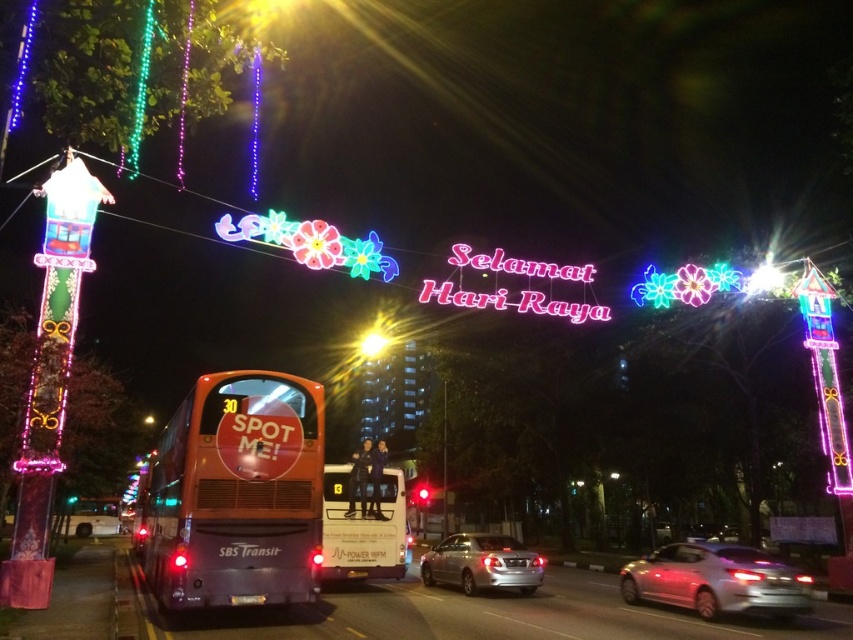
Looking at this image, you are a photographer wanting to capture both the matte orange bus at center and the silver metallic sedan at center in a single frame. Given their heights, which vehicle should you position closer to the camera to ensure both are fully visible without cropping?

Since the matte orange bus at center is much taller than the silver metallic sedan at center, you should position the matte orange bus at center closer to the camera to ensure its full height is captured while still fitting the shorter silver metallic sedan at center in the frame.